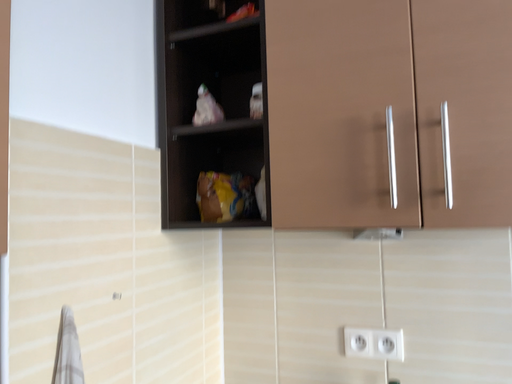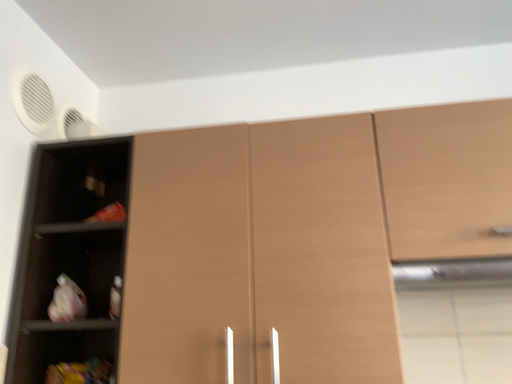
Question: How did the camera likely rotate when shooting the video?

Choices:
 (A) rotated right
 (B) rotated left

Answer: (A)